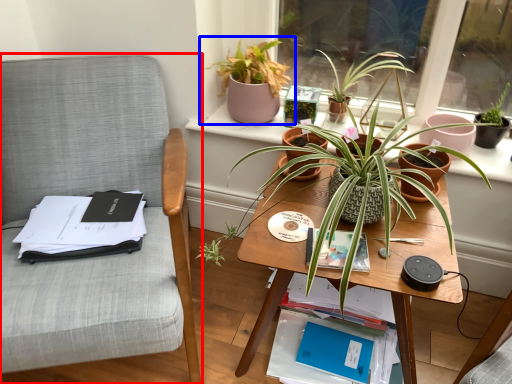
Question: Which of the following is the closest to the observer, chair (highlighted by a red box) or houseplant (highlighted by a blue box)?

Choices:
 (A) chair
 (B) houseplant

Answer: (A)